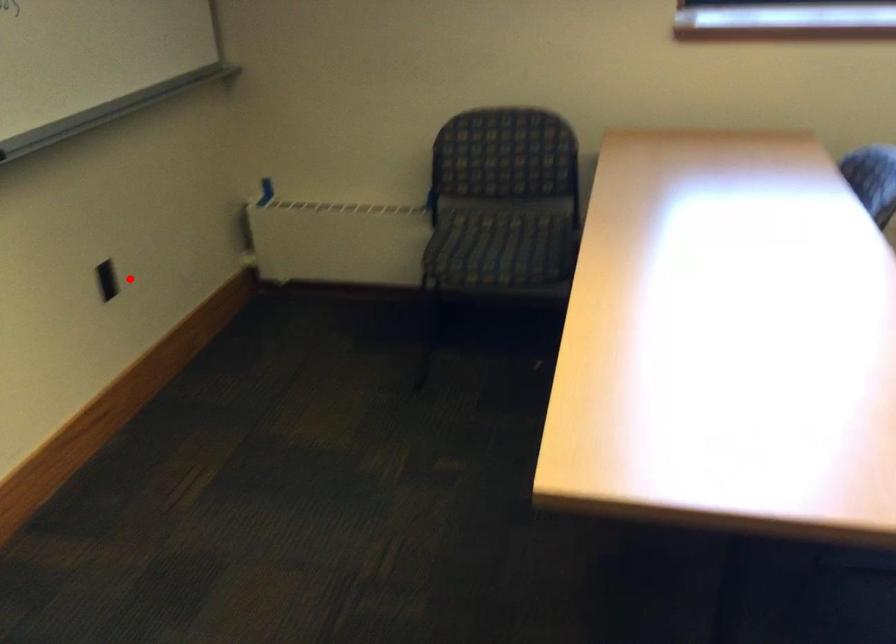
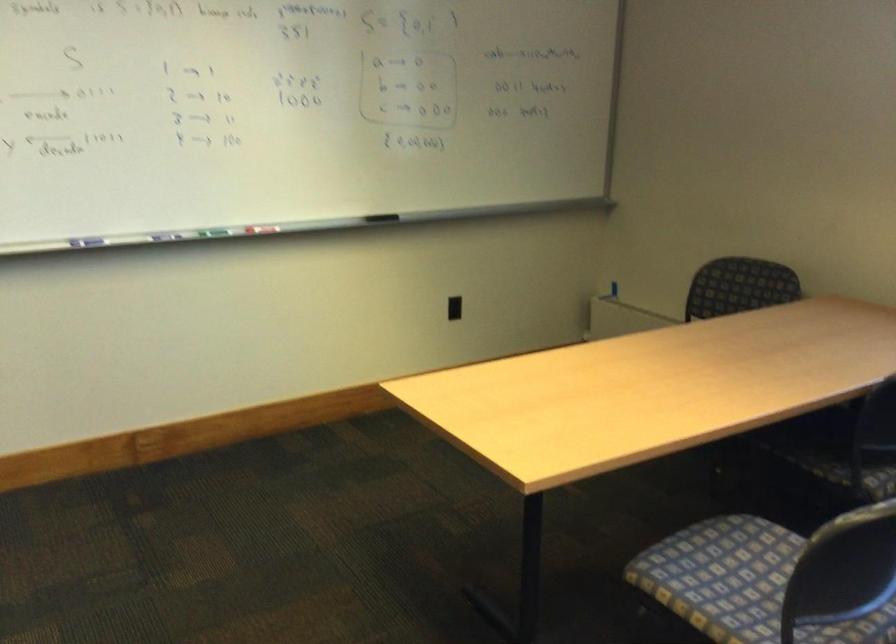
The point at the highlighted location is marked in the first image. Where is the corresponding point in the second image?

(453, 308)